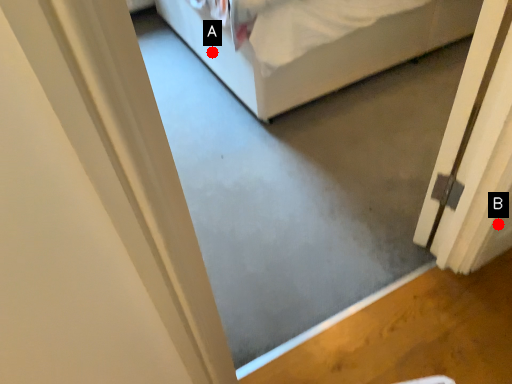
Question: Two points are circled on the image, labeled by A and B beside each circle. Which point is farther to the camera?

Choices:
 (A) A is further
 (B) B is further

Answer: (A)